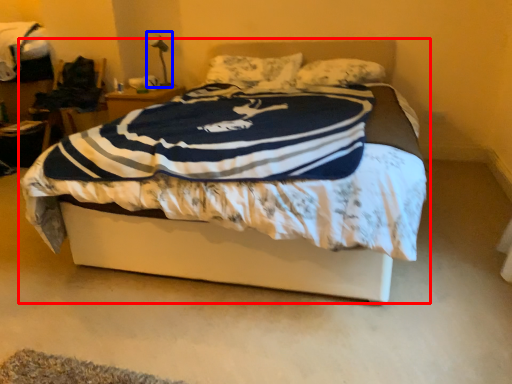
Question: Which point is closer to the camera, bed (highlighted by a red box) or table lamp (highlighted by a blue box)?

Choices:
 (A) bed
 (B) table lamp

Answer: (A)